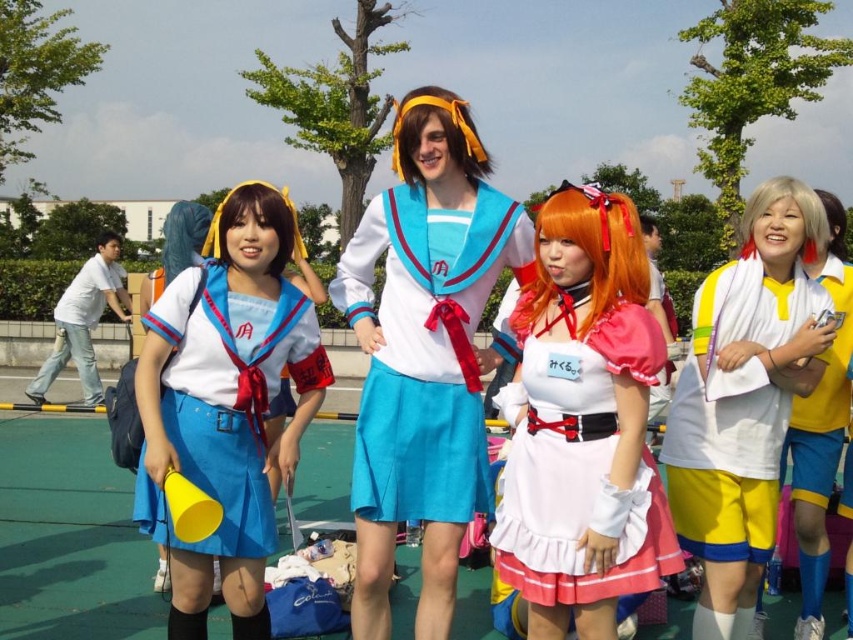
You are a photographer at the cosplay event and want to capture a photo where the white matte wig at right is visible without being blocked by the yellow jersey at right. Based on their positions, is this possible?

The white matte wig at right is behind the yellow jersey at right, so it will be blocked. To make the wig visible, adjust the angle so the jersey is moved or repositioned to allow the wig to be seen.

You are a photographer positioned in front of the group. You notice the yellow fabric shorts at right and the blonde synthetic wig at upper right. Which object should you focus on first to ensure it appears larger in your photo?

The yellow fabric shorts at right is closer to the viewer than the blonde synthetic wig at upper right, so focusing on the yellow fabric shorts at right will make it appear larger in the photo.

You are a photographer trying to capture a group photo of the yellow jersey at right and the white matte wig at right. Since you want to ensure both are clearly visible, which object should you focus on to avoid blurriness due to size differences?

The yellow jersey at right has a smaller width compared to the white matte wig at right, so focusing on the white matte wig at right would ensure both are in focus since it is larger and more prominent.